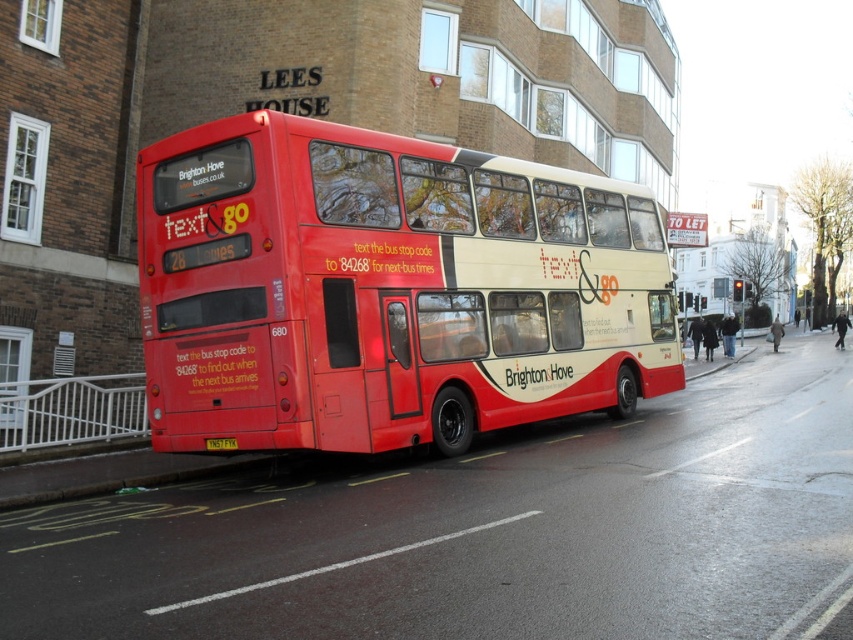
Measure the distance between matte red bus at center and yellow metallic license plate at center.

matte red bus at center is 4.33 meters away from yellow metallic license plate at center.

Locate an element on the screen. The image size is (853, 640). matte red bus at center is located at coordinates (387, 289).

Between point (590, 259) and point (234, 444), which one is positioned behind?

The point (590, 259) is behind.

This screenshot has width=853, height=640. I want to click on matte red bus at center, so click(x=387, y=289).